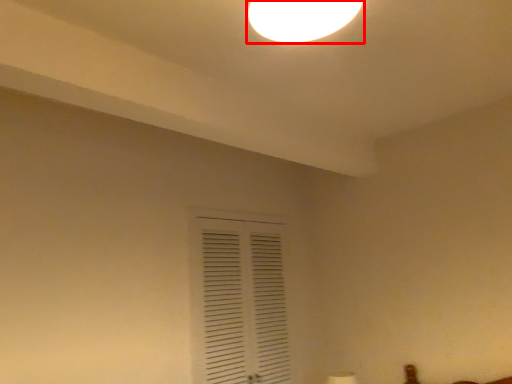
Question: From the image, what is the correct spatial relationship of lamp (annotated by the red box) in relation to window?

Choices:
 (A) left
 (B) right

Answer: (B)